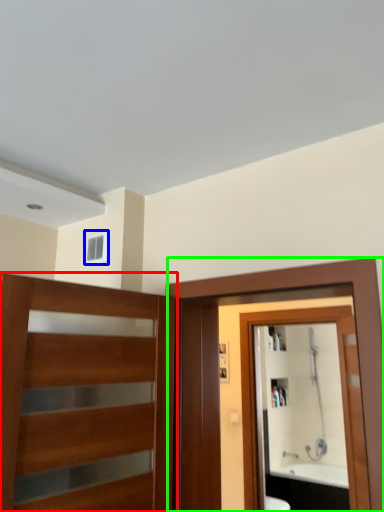
Question: Considering the real-world distances, which object is farthest from door (highlighted by a red box)? window (highlighted by a blue box) or screen door (highlighted by a green box)?

Choices:
 (A) window
 (B) screen door

Answer: (A)